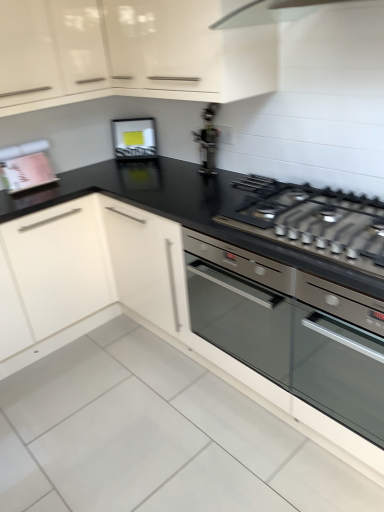
Question: Considering the relative positions of matte black frame at upper center, the 2th appliance positioned from the left, and metallic silver gas stove at center in the image provided, is matte black frame at upper center, the 2th appliance positioned from the left, to the left or to the right of metallic silver gas stove at center?

Choices:
 (A) left
 (B) right

Answer: (A)

Question: Considering the positions of matte black frame at upper center, the second appliance from the right, and metallic silver gas stove at center in the image, is matte black frame at upper center, the second appliance from the right, bigger or smaller than metallic silver gas stove at center?

Choices:
 (A) big
 (B) small

Answer: (B)

Question: Which object is the farthest from the matte black frame at upper center, the second appliance from the right?

Choices:
 (A) satin silver oven at center
 (B) pink matte book at upper left, which appears as the 3th appliance when viewed from the right
 (C) metallic silver toaster at upper center, placed as the first appliance when sorted from right to left
 (D) metallic silver gas stove at center
 (E) glossy white cabinet at upper center

Answer: (A)

Question: Which is farther from the matte black frame at upper center, the 2th appliance positioned from the left?

Choices:
 (A) glossy white cabinet at upper center
 (B) metallic silver toaster at upper center, placed as the first appliance when sorted from right to left
 (C) pink matte book at upper left, the first appliance from the left
 (D) metallic silver gas stove at center
 (E) satin silver oven at center

Answer: (E)